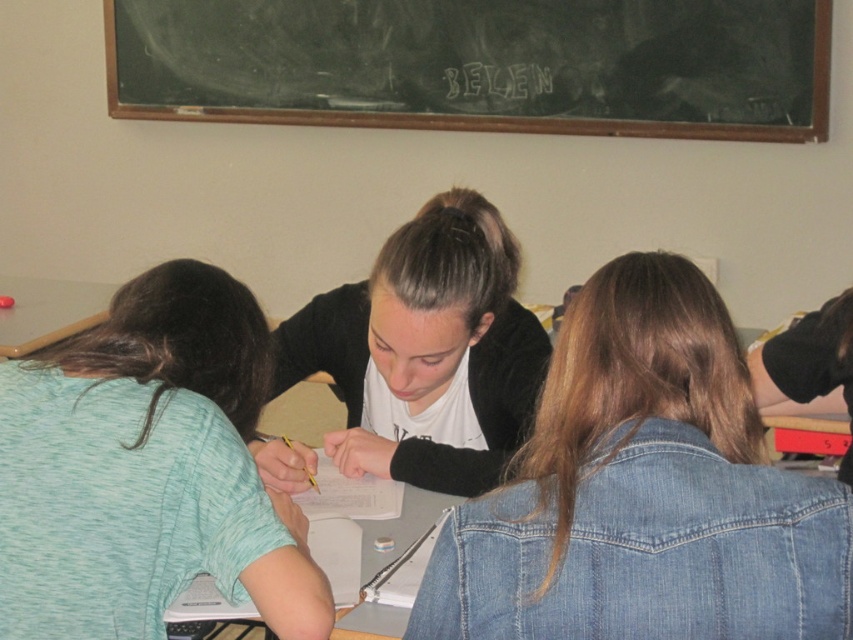
Consider the image. Can you confirm if denim jacket at center is thinner than black chalk writing at upper center?

Incorrect, denim jacket at center's width is not less than black chalk writing at upper center's.

This screenshot has width=853, height=640. I want to click on denim jacket at center, so click(643, 492).

Find the location of a particular element. The height and width of the screenshot is (640, 853). denim jacket at center is located at coordinates (643, 492).

Does black matte shirt at center appear under black chalk writing at upper center?

Yes.

At what (x,y) coordinates should I click in order to perform the action: click on black matte shirt at center. Please return your answer as a coordinate pair (x, y). The height and width of the screenshot is (640, 853). Looking at the image, I should click on (426, 352).

Where is `black matte shirt at center`? This screenshot has width=853, height=640. black matte shirt at center is located at coordinates (426, 352).

Describe the element at coordinates (643, 492) in the screenshot. I see `denim jacket at center` at that location.

Does denim jacket at center have a lesser height compared to white paper at center?

In fact, denim jacket at center may be taller than white paper at center.

Measure the distance between point (737,481) and camera.

Point (737,481) and camera are 91.25 centimeters apart.

Find the location of `denim jacket at center`. denim jacket at center is located at coordinates (643, 492).